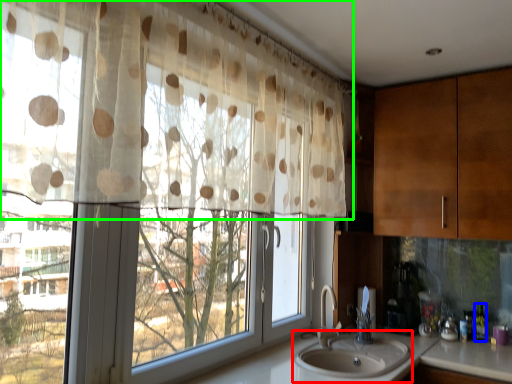
Question: Estimate the real-world distances between objects in this image. Which object is closer to sink (highlighted by a red box), bottle (highlighted by a blue box) or curtain (highlighted by a green box)?

Choices:
 (A) bottle
 (B) curtain

Answer: (A)